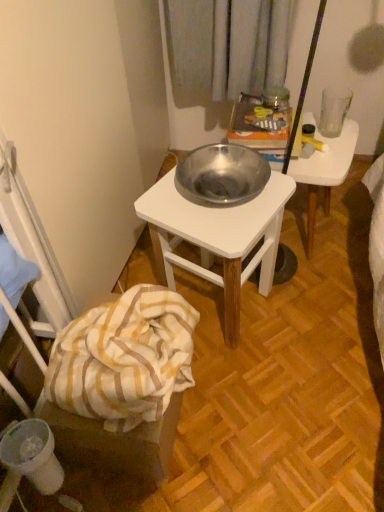
What are the coordinates of `free point below metallic silver bowl at center (from a real-world perspective)` in the screenshot? It's located at (301, 242).